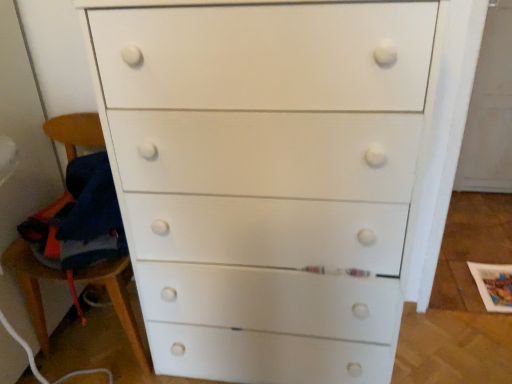
Locate an element on the screen. This screenshot has height=384, width=512. wooden chair at left is located at coordinates (31, 284).

Image resolution: width=512 pixels, height=384 pixels. What do you see at coordinates (31, 284) in the screenshot? I see `wooden chair at left` at bounding box center [31, 284].

Image resolution: width=512 pixels, height=384 pixels. I want to click on wooden chair at left, so click(x=31, y=284).